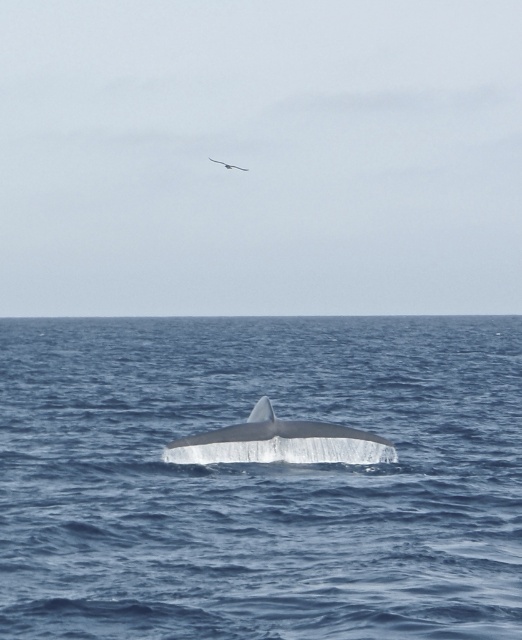
Who is positioned more to the left, blue smooth water at center or white smooth whale at center?

blue smooth water at center is more to the left.

Is point (218, 525) in front of point (220, 429)?

Yes.

The image size is (522, 640). Find the location of `blue smooth water at center`. blue smooth water at center is located at coordinates (259, 480).

Identify the location of blue smooth water at center. (259, 480).